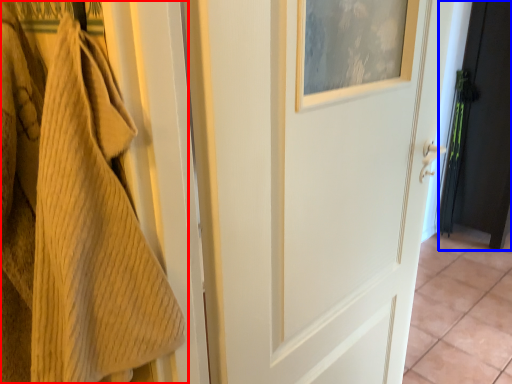
Question: Which point is further to the camera, towel (highlighted by a red box) or door (highlighted by a blue box)?

Choices:
 (A) towel
 (B) door

Answer: (B)